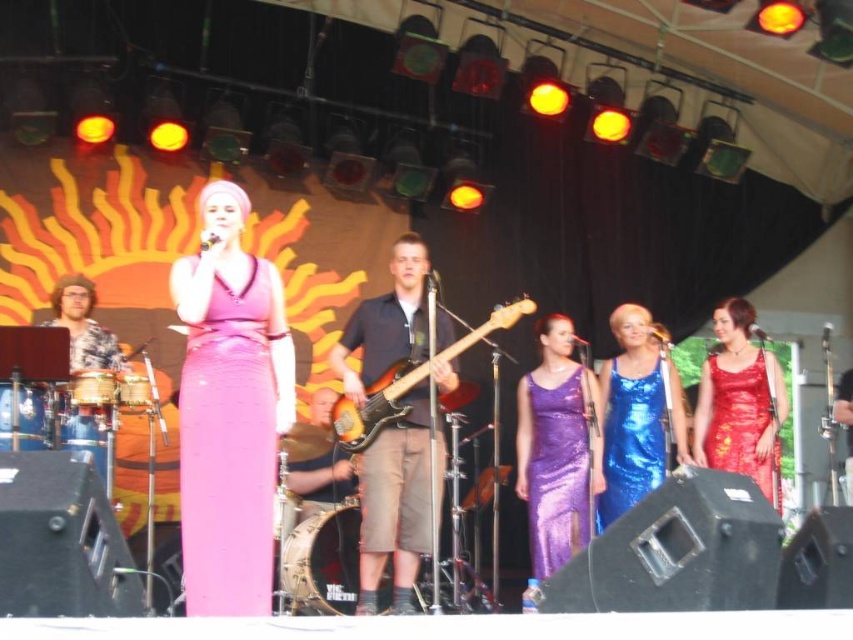
The height and width of the screenshot is (640, 853). What are the coordinates of `pink satin dress at center` in the screenshot? It's located at (228, 449).

Does point (270, 365) come in front of point (341, 458)?

Yes.

Where is `pink satin dress at center`? The image size is (853, 640). pink satin dress at center is located at coordinates (x=228, y=449).

Is pink satin dress at center bigger than shiny red dress at center?

Correct, pink satin dress at center is larger in size than shiny red dress at center.

Which is behind, point (225, 292) or point (714, 396)?

Positioned behind is point (714, 396).

Locate an element on the screen. The width and height of the screenshot is (853, 640). pink satin dress at center is located at coordinates (228, 449).

Is dark blue fabric shirt at center further to camera compared to shiny blue dress at center?

That is False.

Which is more to the right, dark blue fabric shirt at center or shiny blue dress at center?

Positioned to the right is shiny blue dress at center.

Is point (405, 577) farther from viewer compared to point (625, 394)?

That is False.

Where is `dark blue fabric shirt at center`? The image size is (853, 640). dark blue fabric shirt at center is located at coordinates (395, 506).